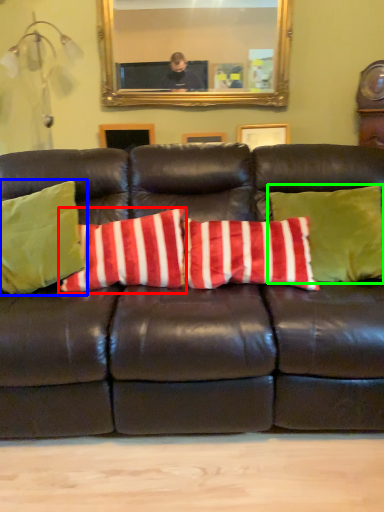
Question: Which is farther away from pillow (highlighted by a red box)? pillow (highlighted by a blue box) or pillow (highlighted by a green box)?

Choices:
 (A) pillow
 (B) pillow

Answer: (B)